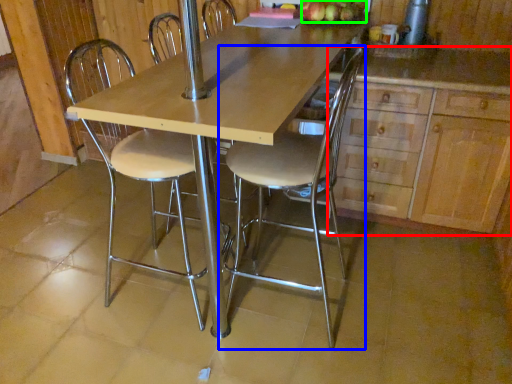
Question: Considering the real-world distances, which object is closest to cabinetry (highlighted by a red box)? chair (highlighted by a blue box) or apple (highlighted by a green box).

Choices:
 (A) chair
 (B) apple

Answer: (A)